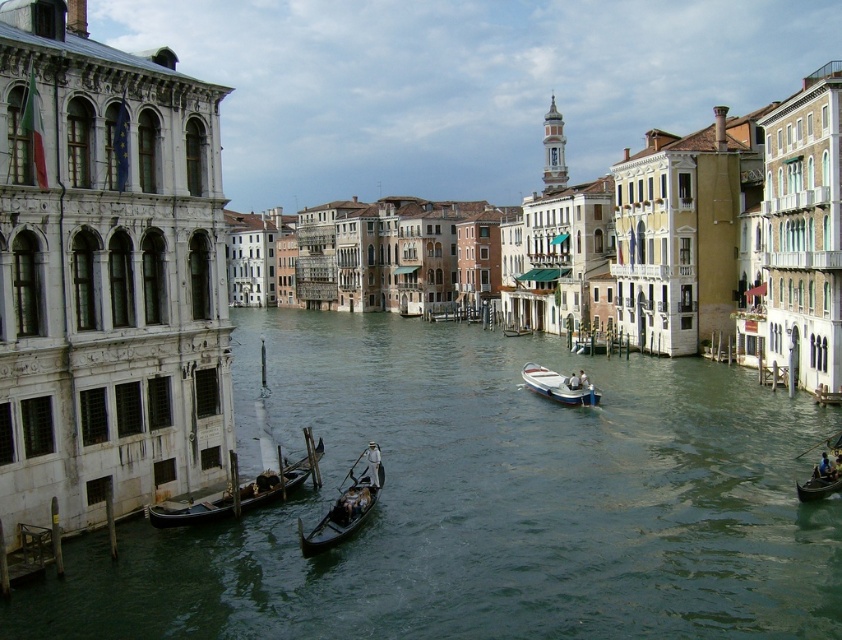
Is black polished wood gondola at center positioned behind white plastic boat at center?

No.

Does black polished wood gondola at center appear on the right side of white plastic boat at center?

Incorrect, black polished wood gondola at center is not on the right side of white plastic boat at center.

Locate an element on the screen. The width and height of the screenshot is (842, 640). black polished wood gondola at center is located at coordinates (347, 506).

Does point (153, 518) lie behind point (328, 518)?

No, it is in front of (328, 518).

Find the location of `black polished gondola at lower left`. black polished gondola at lower left is located at coordinates (233, 499).

Can you confirm if white plastic boat at center is bigger than wooden dark brown boat at lower right?

Indeed, white plastic boat at center has a larger size compared to wooden dark brown boat at lower right.

Between white plastic boat at center and wooden dark brown boat at lower right, which one has more height?

white plastic boat at center is taller.

Is point (533, 388) behind point (839, 474)?

That is True.

Find the location of a particular element. The width and height of the screenshot is (842, 640). white plastic boat at center is located at coordinates [558, 385].